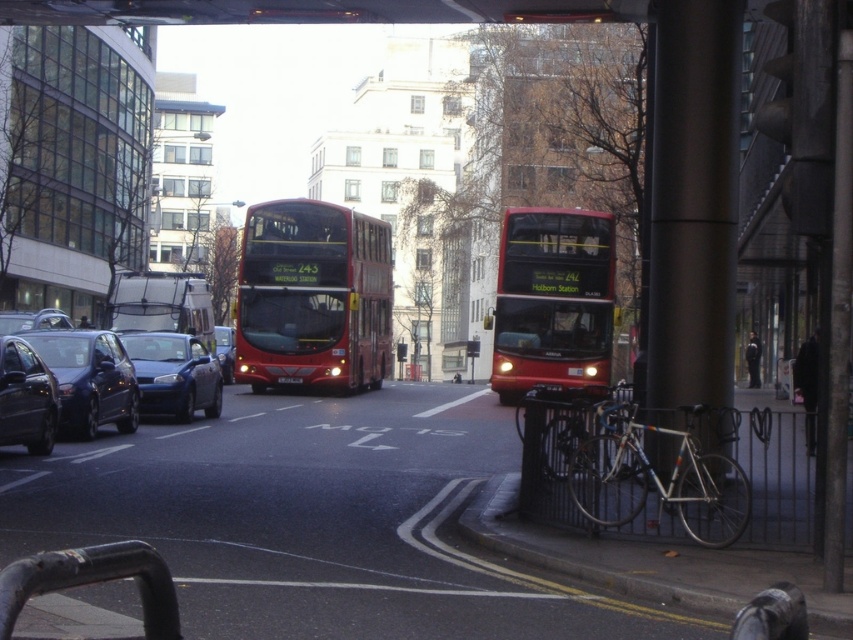
You are a delivery person who needs to load a tall package that is 2 meters in height. You see the metallic silver bus at center and the shiny black sedan at left. Which vehicle can accommodate the height of your package?

The metallic silver bus at center has a greater height compared to the shiny black sedan at left, so the metallic silver bus at center can accommodate the 2 meter tall package.

You are a pedestrian standing on the sidewalk and see the shiny red bus at center and the black plastic license plate at center. Which object is closer to your right side?

The shiny red bus at center is closer to your right side because it is positioned to the right of the black plastic license plate at center.